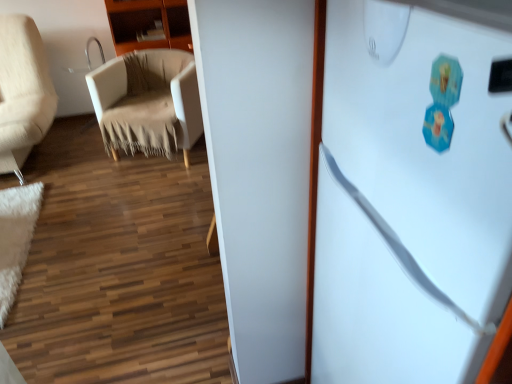
Question: Considering the relative sizes of white fluffy mat at lower left and wooden cabinet at upper left in the image provided, is white fluffy mat at lower left smaller than wooden cabinet at upper left?

Choices:
 (A) yes
 (B) no

Answer: (A)

Question: Is white fluffy mat at lower left facing away from wooden cabinet at upper left?

Choices:
 (A) yes
 (B) no

Answer: (B)

Question: Is white fluffy mat at lower left to the left of wooden cabinet at upper left from the viewer's perspective?

Choices:
 (A) yes
 (B) no

Answer: (A)

Question: From the image's perspective, is white fluffy mat at lower left over wooden cabinet at upper left?

Choices:
 (A) no
 (B) yes

Answer: (A)

Question: Considering the relative positions of white fluffy mat at lower left and wooden cabinet at upper left in the image provided, is white fluffy mat at lower left to the right of wooden cabinet at upper left from the viewer's perspective?

Choices:
 (A) no
 (B) yes

Answer: (A)

Question: From a real-world perspective, is white fluffy mat at lower left positioned above or below beige fabric chair at left?

Choices:
 (A) above
 (B) below

Answer: (B)

Question: Is white fluffy mat at lower left wider or thinner than beige fabric chair at left?

Choices:
 (A) thin
 (B) wide

Answer: (A)

Question: Considering the positions of white fluffy mat at lower left and beige fabric chair at left in the image, is white fluffy mat at lower left bigger or smaller than beige fabric chair at left?

Choices:
 (A) small
 (B) big

Answer: (A)

Question: Is white fluffy mat at lower left in front of or behind beige fabric chair at left in the image?

Choices:
 (A) front
 (B) behind

Answer: (A)

Question: From a real-world perspective, is wooden cabinet at upper left positioned above or below white fluffy mat at lower left?

Choices:
 (A) above
 (B) below

Answer: (A)

Question: Is point (123, 6) positioned closer to the camera than point (5, 193)?

Choices:
 (A) closer
 (B) farther

Answer: (B)

Question: Is wooden cabinet at upper left inside the boundaries of white fluffy mat at lower left, or outside?

Choices:
 (A) outside
 (B) inside

Answer: (A)

Question: From their relative heights in the image, would you say wooden cabinet at upper left is taller or shorter than white fluffy mat at lower left?

Choices:
 (A) short
 (B) tall

Answer: (B)

Question: In terms of size, does white fluffy mat at lower left appear bigger or smaller than wooden cabinet at upper left?

Choices:
 (A) small
 (B) big

Answer: (A)

Question: Is point (2, 215) closer or farther from the camera than point (187, 48)?

Choices:
 (A) farther
 (B) closer

Answer: (B)